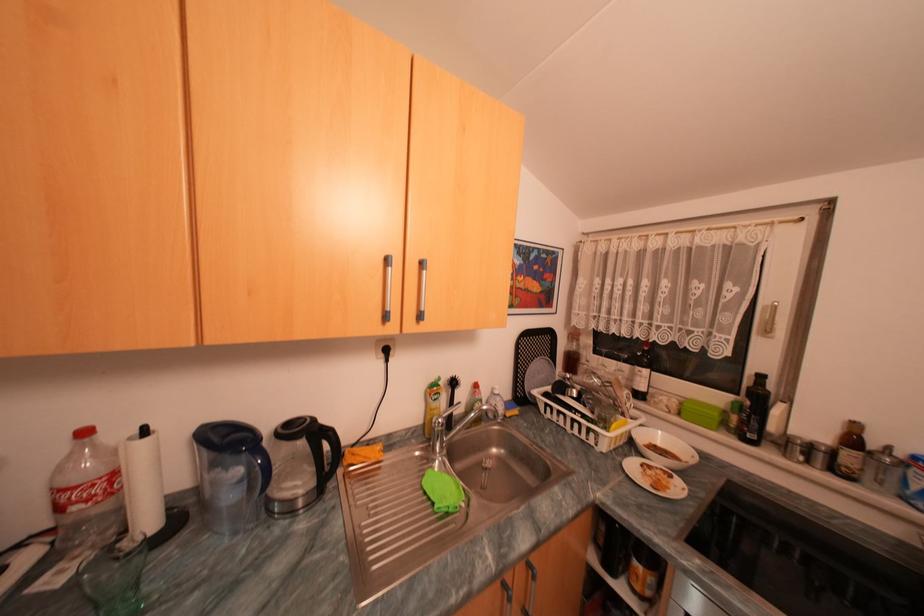
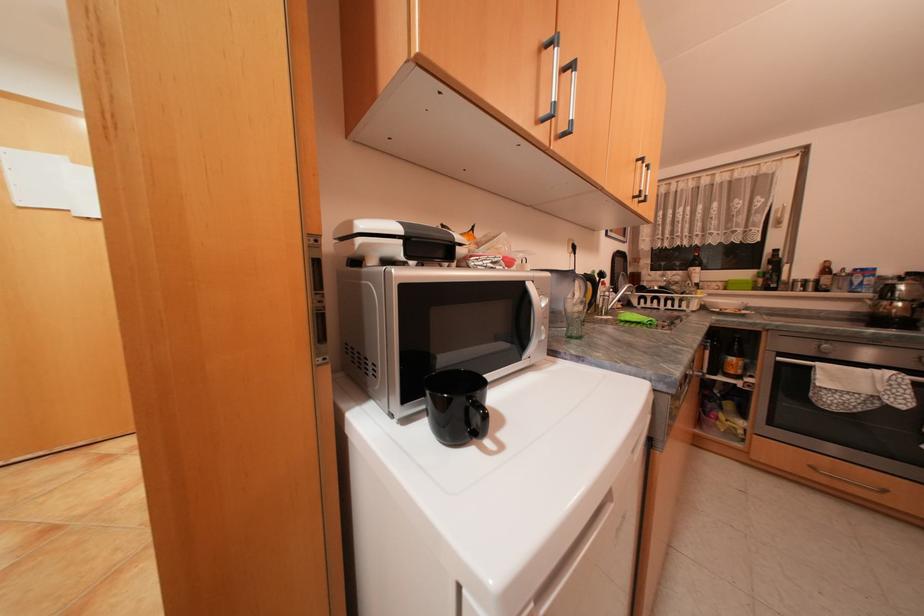
The point at [448,378] is marked in the first image. Where is the corresponding point in the second image?

(602, 270)